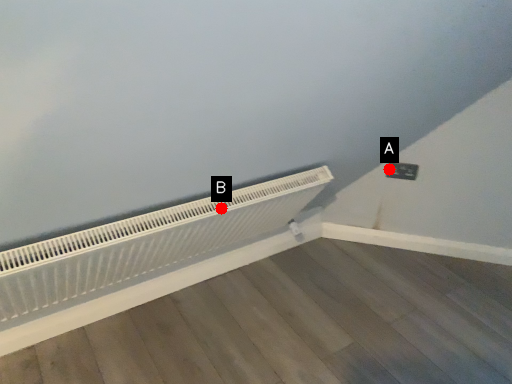
Question: Two points are circled on the image, labeled by A and B beside each circle. Which point appears closest to the camera in this image?

Choices:
 (A) A is closer
 (B) B is closer

Answer: (B)